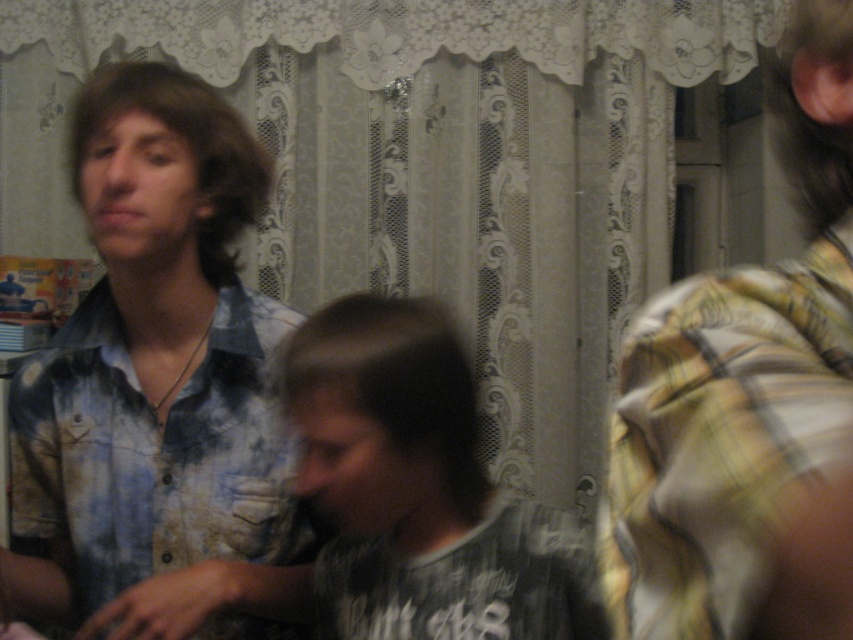
Does yellow plaid shirt at right have a greater height compared to dark gray t-shirt at center?

Indeed, yellow plaid shirt at right has a greater height compared to dark gray t-shirt at center.

Between yellow plaid shirt at right and dark gray t-shirt at center, which one appears on the left side from the viewer's perspective?

From the viewer's perspective, dark gray t-shirt at center appears more on the left side.

Who is more distant from viewer, (693, 420) or (386, 609)?

The point (386, 609) is more distant.

Where is `yellow plaid shirt at right`? yellow plaid shirt at right is located at coordinates (747, 404).

The image size is (853, 640). In order to click on blue tie-dye shirt at left in this screenshot , I will do `click(157, 387)`.

Does point (236, 628) come behind point (285, 355)?

Yes, point (236, 628) is behind point (285, 355).

Which is behind, point (115, 294) or point (587, 577)?

Positioned behind is point (115, 294).

Where is `blue tie-dye shirt at left`? blue tie-dye shirt at left is located at coordinates (157, 387).

Between blue tie-dye shirt at left and yellow plaid shirt at right, which one is positioned higher?

Positioned higher is yellow plaid shirt at right.

Does blue tie-dye shirt at left have a larger size compared to yellow plaid shirt at right?

Correct, blue tie-dye shirt at left is larger in size than yellow plaid shirt at right.

Who is more forward, (12, 438) or (677, 628)?

Point (677, 628)

This screenshot has height=640, width=853. I want to click on blue tie-dye shirt at left, so click(157, 387).